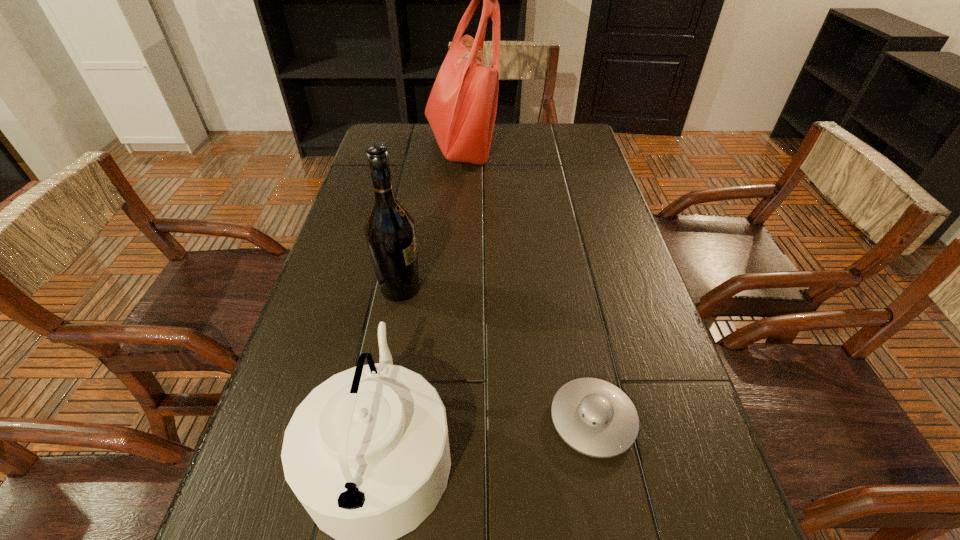
Where is `object present at the left edge`? This screenshot has height=540, width=960. object present at the left edge is located at coordinates (x=390, y=232).

The width and height of the screenshot is (960, 540). What are the coordinates of `object that is at the right edge` in the screenshot? It's located at (594, 417).

In the image, there is a desktop. Identify the location of vacant space at the far edge. point(501,156).

You are a GUI agent. You are given a task and a screenshot of the screen. Output one action in this format:
    pyautogui.click(x=<x>, y=<y>)
    Task: Click on the vacant space at the left edge of the desktop
    This screenshot has width=960, height=540.
    Given the screenshot: What is the action you would take?
    pyautogui.click(x=362, y=232)

Locate an element on the screen. The height and width of the screenshot is (540, 960). free spot at the right edge of the desktop is located at coordinates (638, 352).

Find the location of a particular element. This screenshot has width=960, height=540. vacant space at the far right corner is located at coordinates (574, 133).

The height and width of the screenshot is (540, 960). In order to click on unoccupied area between the saucer and the tallest object in this screenshot , I will do `click(526, 283)`.

Locate an element on the screen. This screenshot has width=960, height=540. free space between the handbag and the wine bottle is located at coordinates 430,218.

The width and height of the screenshot is (960, 540). Identify the location of free space between the saucer and the tallest object. (526, 283).

You are a GUI agent. You are given a task and a screenshot of the screen. Output one action in this format:
    pyautogui.click(x=<x>, y=<y>)
    Task: Click on the free spot between the rightmost object and the second farthest object
    
    Given the screenshot: What is the action you would take?
    pyautogui.click(x=496, y=354)